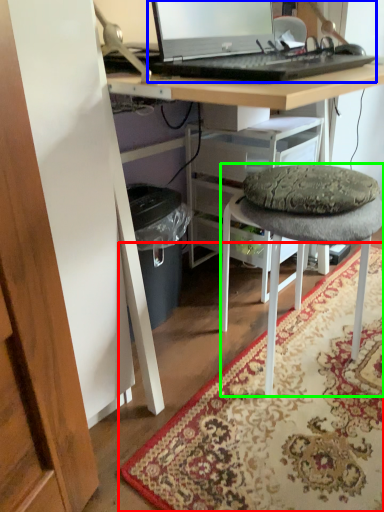
Question: Which object is positioned farthest from mat (highlighted by a red box)? Select from computer (highlighted by a blue box) and stool (highlighted by a green box).

Choices:
 (A) computer
 (B) stool

Answer: (A)